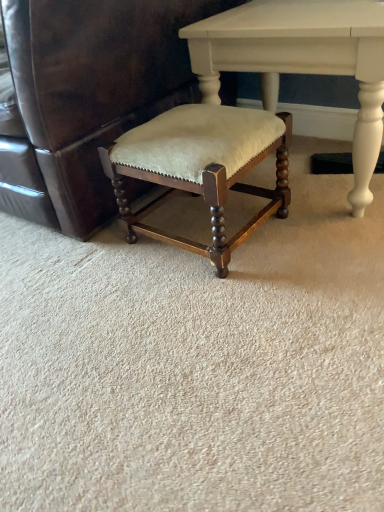
Where is `vacant space to the right of velvet beige stool at center`? vacant space to the right of velvet beige stool at center is located at coordinates (321, 242).